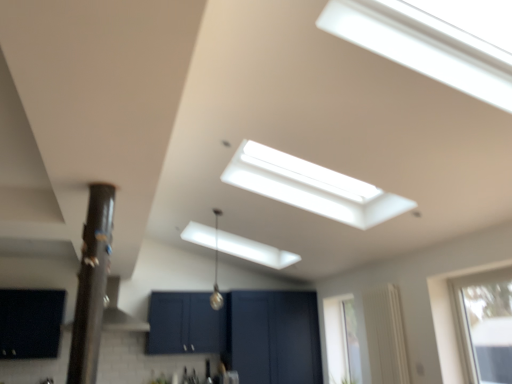
Question: In the image, is metallic silver light fixture at upper center positioned in front of or behind matte black cabinet at lower left, which is counted as the 1th window, starting from the left?

Choices:
 (A) front
 (B) behind

Answer: (A)

Question: Is metallic silver light fixture at upper center wider or thinner than matte black cabinet at lower left, the 3th window viewed from the right?

Choices:
 (A) wide
 (B) thin

Answer: (B)

Question: Which of these objects is positioned closest to the satin silver exhaust hood at left?

Choices:
 (A) matte black cabinet at lower left, the second window viewed from the back
 (B) dark blue matte cabinet at center
 (C) transparent glass window at upper right, placed as the 1th window when sorted from front to back
 (D) black glossy pole at left
 (E) metallic silver light fixture at upper center

Answer: (E)

Question: Estimate the real-world distances between objects in this image. Which object is closer to the matte black cabinet at lower left, the 3th window viewed from the right?

Choices:
 (A) transparent glass window at upper right, marked as the 3th window in a left-to-right arrangement
 (B) dark blue matte cabinet at center
 (C) clear glass window at right, marked as the second window in a right-to-left arrangement
 (D) satin silver exhaust hood at left
 (E) metallic silver light fixture at upper center

Answer: (D)